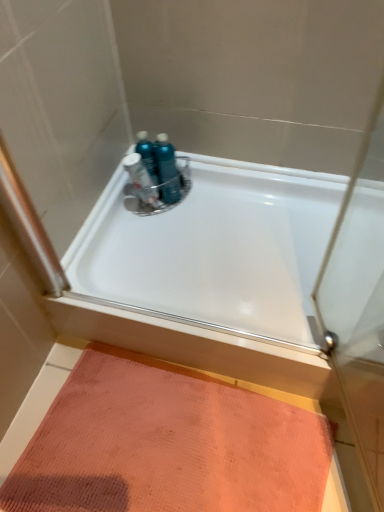
In order to click on vacant space in front of teal plastic bottles at center, the third toiletry viewed from the left in this screenshot , I will do `click(179, 223)`.